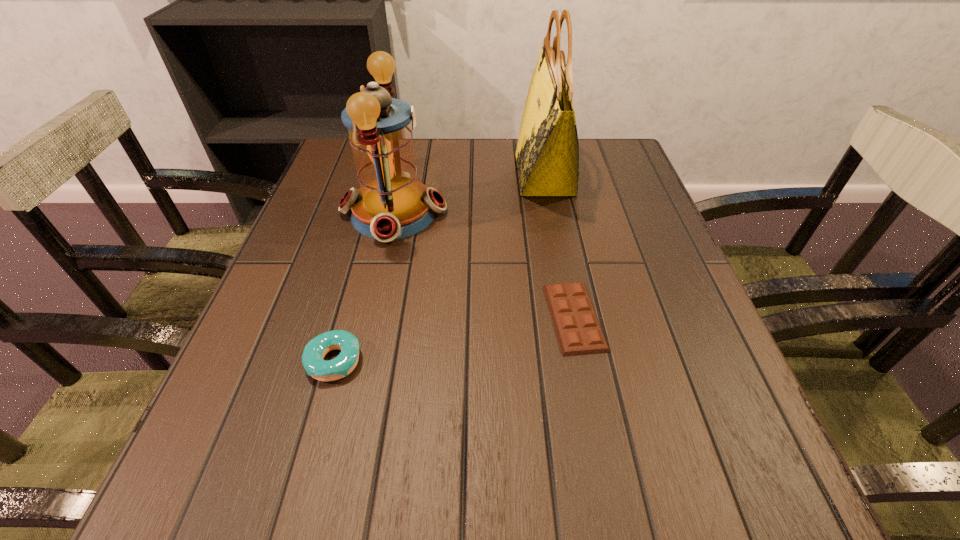
The image size is (960, 540). Find the location of `the tallest object`. the tallest object is located at coordinates (547, 155).

Where is `the third shortest object`? the third shortest object is located at coordinates (391, 204).

Locate an element on the screen. The width and height of the screenshot is (960, 540). doughnut is located at coordinates (314, 352).

The image size is (960, 540). Find the location of `the shortest object`. the shortest object is located at coordinates (578, 330).

You are a GUI agent. You are given a task and a screenshot of the screen. Output one action in this format:
    pyautogui.click(x=<x>, y=<y>)
    Task: Click on the vacant space located on the front-facing side of the tallest object
    This screenshot has height=540, width=960.
    Given the screenshot: What is the action you would take?
    pyautogui.click(x=396, y=174)

Where is `free space located 0.340m on the front-facing side of the tallest object`? This screenshot has height=540, width=960. free space located 0.340m on the front-facing side of the tallest object is located at coordinates (383, 174).

This screenshot has height=540, width=960. What are the coordinates of `vacant area situated on the front-facing side of the tallest object` in the screenshot? It's located at (419, 174).

I want to click on vacant space located on the front-facing side of the lantern, so click(517, 212).

Where is `vacant space located 0.150m on the front of the second shortest object`? This screenshot has width=960, height=540. vacant space located 0.150m on the front of the second shortest object is located at coordinates (300, 485).

Locate an element on the screen. The width and height of the screenshot is (960, 540). free space located 0.310m on the back of the shortest object is located at coordinates pyautogui.click(x=550, y=191).